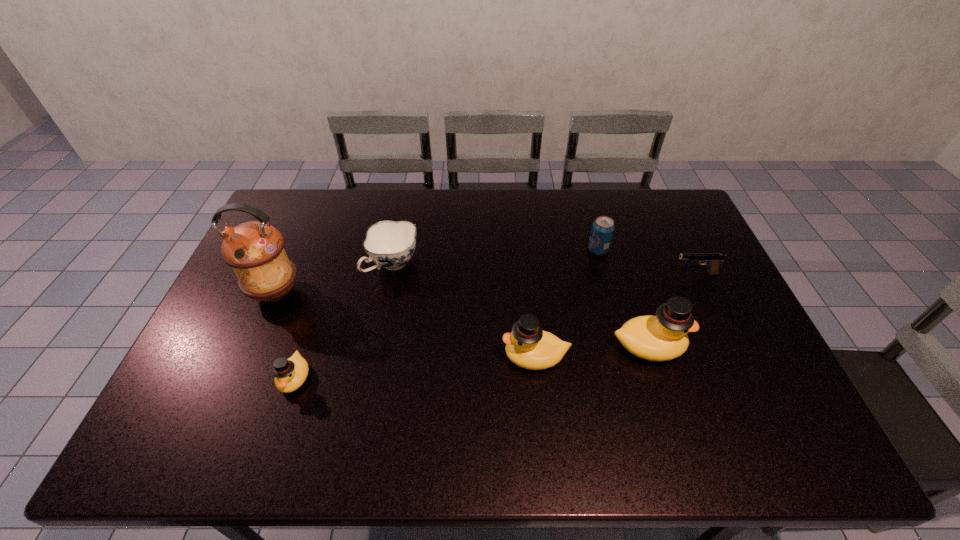
Locate an element on the screen. the leftmost duck is located at coordinates (290, 374).

At what (x,y) coordinates should I click in order to perform the action: click on the second object from left to right. Please return your answer as a coordinate pair (x, y). Looking at the image, I should click on (290, 374).

The image size is (960, 540). In order to click on the third tallest object in this screenshot , I will do `click(528, 346)`.

Where is `the fourth object from right to left`? The image size is (960, 540). the fourth object from right to left is located at coordinates (528, 346).

Locate an element on the screen. Image resolution: width=960 pixels, height=540 pixels. the rightmost duck is located at coordinates (663, 337).

Where is `pop soda`? The width and height of the screenshot is (960, 540). pop soda is located at coordinates (603, 227).

You are a GUI agent. You are given a task and a screenshot of the screen. Output one action in this format:
    pyautogui.click(x=<x>, y=<y>)
    Task: Click on the chinaware
    The height and width of the screenshot is (540, 960).
    Given the screenshot: What is the action you would take?
    pyautogui.click(x=391, y=244)

Find the location of a particular element. Image resolution: width=960 pixels, height=540 pixels. the tallest object is located at coordinates (255, 250).

I want to click on the leftmost object, so click(255, 250).

Find the location of a particular element. the rightmost object is located at coordinates [x=713, y=260].